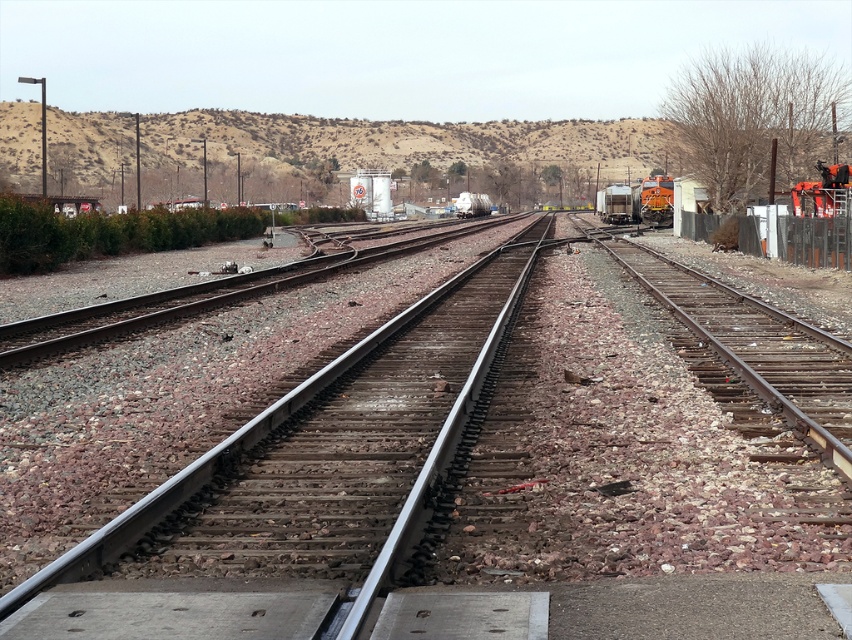
You are standing at the bottom edge of the frame near the concrete platform. You want to walk to the metal smooth train track at center located at point (314, 456). What path should you take to reach it?

To reach the metal smooth train track at center located at point (314, 456) from the concrete platform at the bottom edge, you should walk straight ahead along the tracks towards the center of the image. The tracks are parallel and converge into the distance, so following the path of the tracks will lead you directly to the specified point.